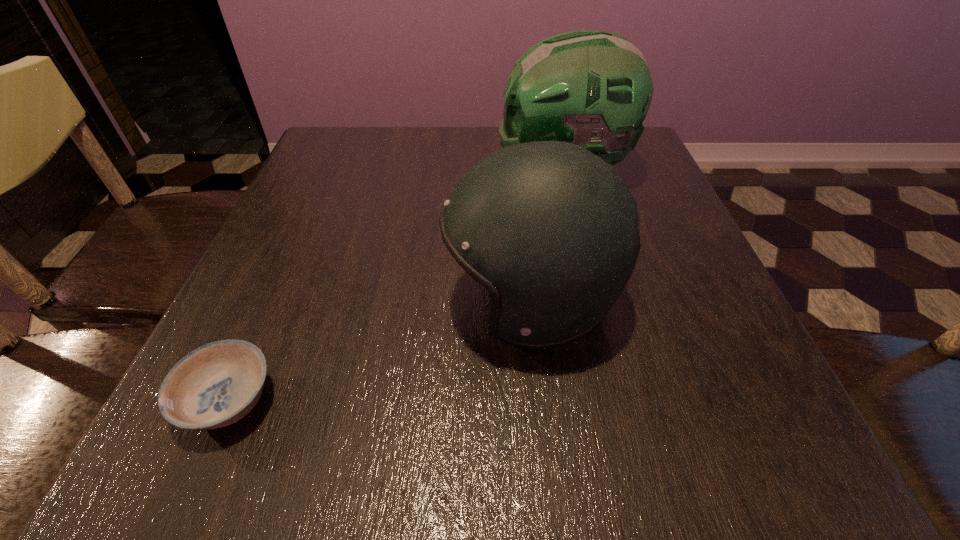
At what (x,y) coordinates should I click in order to perform the action: click on vacant space at the right edge of the desktop. Please return your answer as a coordinate pair (x, y). Looking at the image, I should click on (670, 192).

The image size is (960, 540). I want to click on free space at the far left corner of the desktop, so click(x=321, y=148).

The image size is (960, 540). Find the location of `vacant position at the near left corner of the desktop`. vacant position at the near left corner of the desktop is located at coordinates (217, 448).

Image resolution: width=960 pixels, height=540 pixels. What are the coordinates of `vacant space at the far right corner of the desktop` in the screenshot? It's located at (638, 174).

Locate an element on the screen. Image resolution: width=960 pixels, height=540 pixels. vacant space at the near right corner is located at coordinates (827, 483).

The height and width of the screenshot is (540, 960). Find the location of `free spot between the farther football helmet and the shortest object`. free spot between the farther football helmet and the shortest object is located at coordinates (396, 286).

Where is `vacant space that is in between the leftmost object and the nearer football helmet`? This screenshot has height=540, width=960. vacant space that is in between the leftmost object and the nearer football helmet is located at coordinates (380, 351).

You are a GUI agent. You are given a task and a screenshot of the screen. Output one action in this format:
    pyautogui.click(x=<x>, y=<y>)
    Task: Click on the free space between the shortest object and the farther football helmet
    
    Given the screenshot: What is the action you would take?
    pyautogui.click(x=396, y=286)

At what (x,y) coordinates should I click in order to perform the action: click on free point between the nearer football helmet and the bowl. Please return your answer as a coordinate pair (x, y). This screenshot has height=540, width=960. Looking at the image, I should click on (380, 351).

Where is `blank region between the shortest object and the nearer football helmet`? The height and width of the screenshot is (540, 960). blank region between the shortest object and the nearer football helmet is located at coordinates (380, 351).